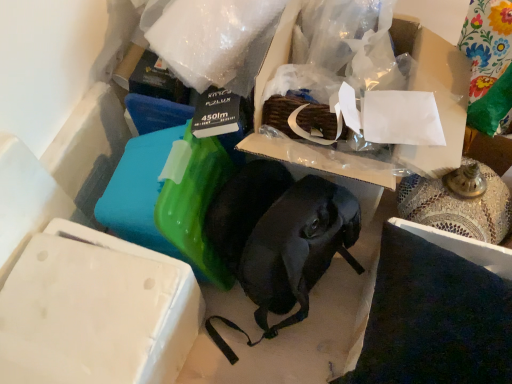
Find the location of a particular element. The image size is (512, 384). vacant area on top of white matte box at lower left (from a real-world perspective) is located at coordinates (78, 312).